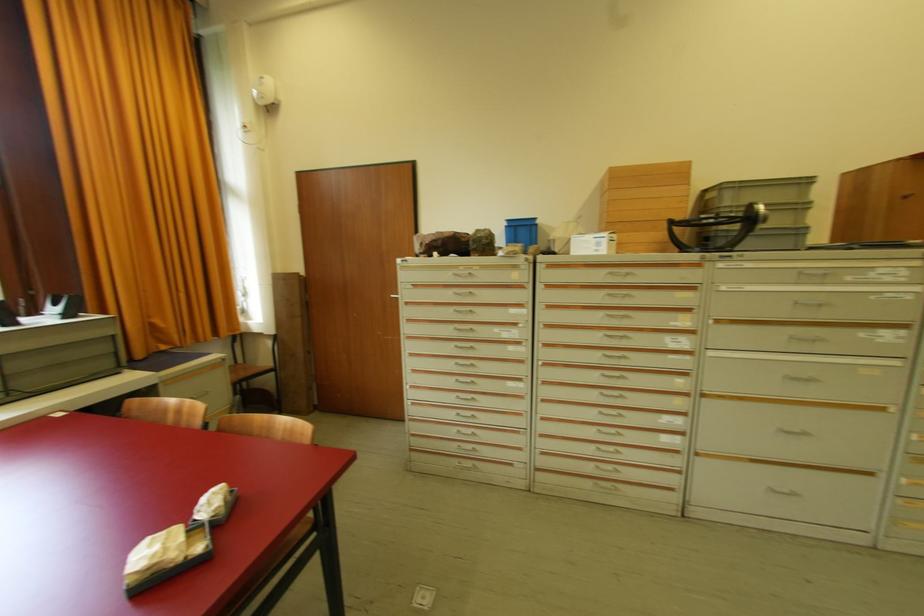
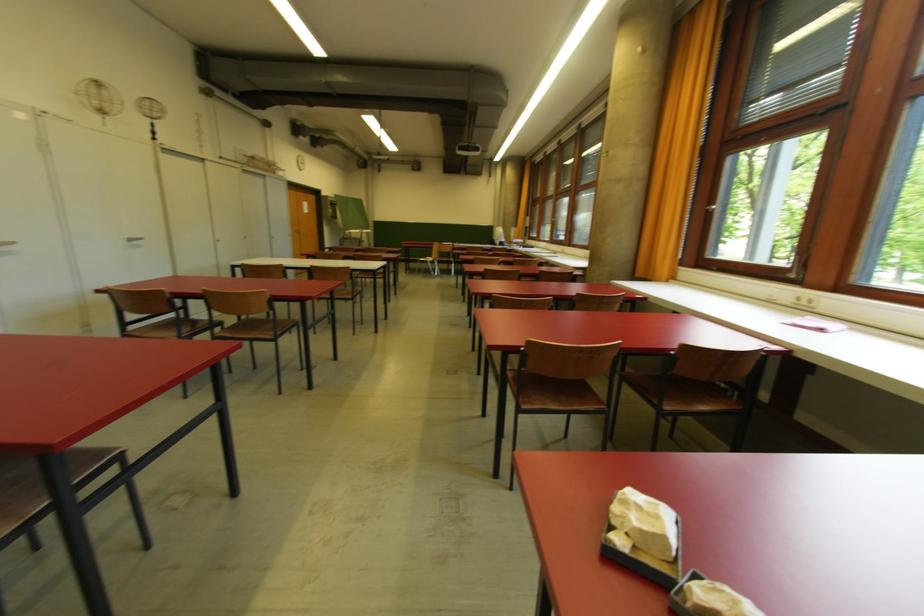
The point at (220, 513) is marked in the first image. Where is the corresponding point in the second image?

(690, 596)